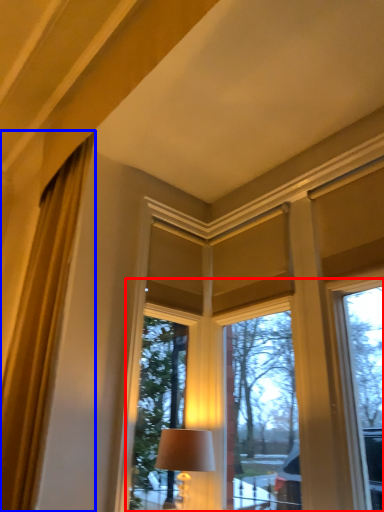
Question: Which object is further to the camera taking this photo, bay window (highlighted by a red box) or curtain (highlighted by a blue box)?

Choices:
 (A) bay window
 (B) curtain

Answer: (A)